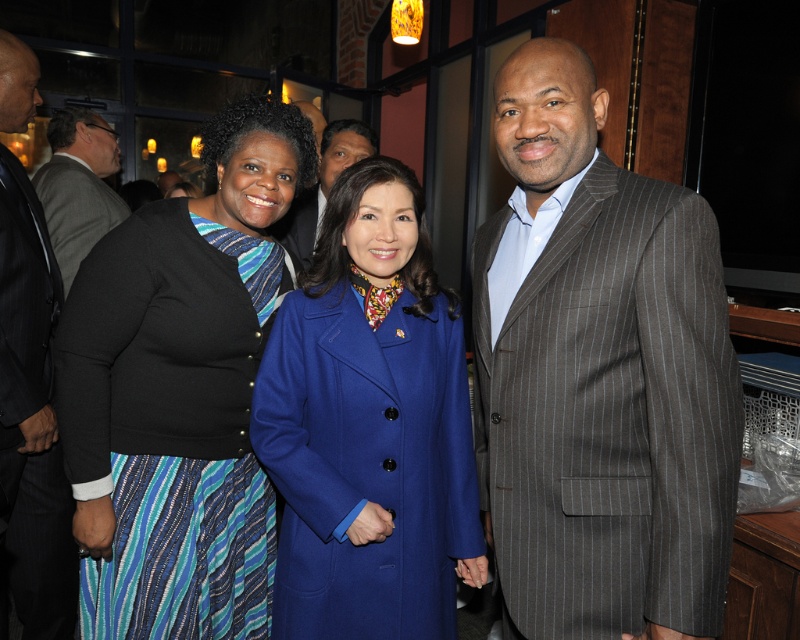
Question: Does gray pinstripe suit at right have a greater width compared to black textured cardigan at left?

Choices:
 (A) no
 (B) yes

Answer: (A)

Question: Does gray pinstripe suit at right have a larger size compared to dark gray pinstripe suit at left?

Choices:
 (A) no
 (B) yes

Answer: (A)

Question: Can you confirm if dark gray pinstripe suit at left is bigger than gray pinstripe suit at left?

Choices:
 (A) yes
 (B) no

Answer: (A)

Question: Among these points, which one is nearest to the camera?

Choices:
 (A) (34, 291)
 (B) (162, 552)
 (C) (333, 150)

Answer: (B)

Question: Based on their relative distances, which object is farther from the dark gray pinstripe suit at left?

Choices:
 (A) gray pinstripe suit at center
 (B) gray pinstripe suit at left
 (C) black textured cardigan at left
 (D) blue wool coat at center

Answer: (A)

Question: Which of the following is the closest to the observer?

Choices:
 (A) gray pinstripe suit at center
 (B) gray pinstripe suit at right
 (C) blue wool coat at center

Answer: (B)